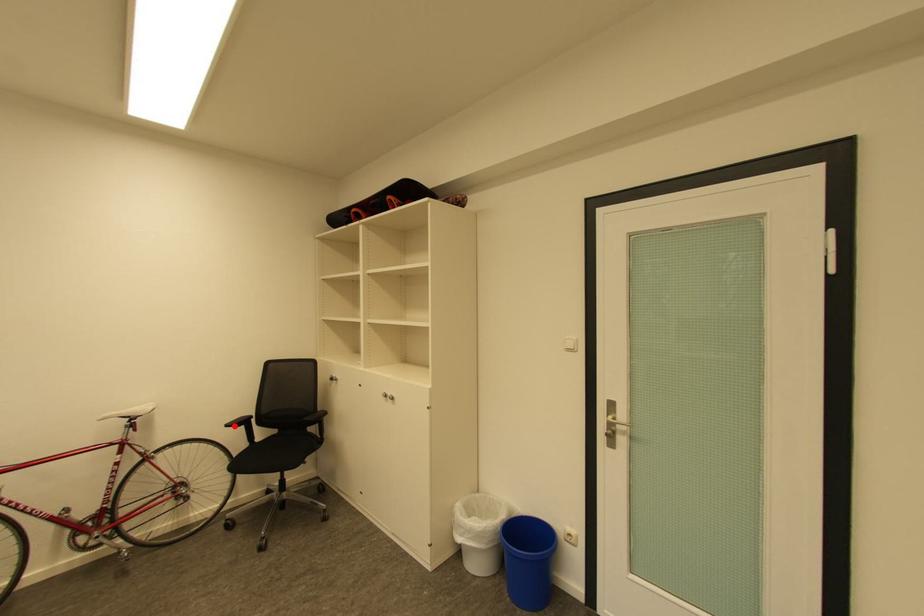
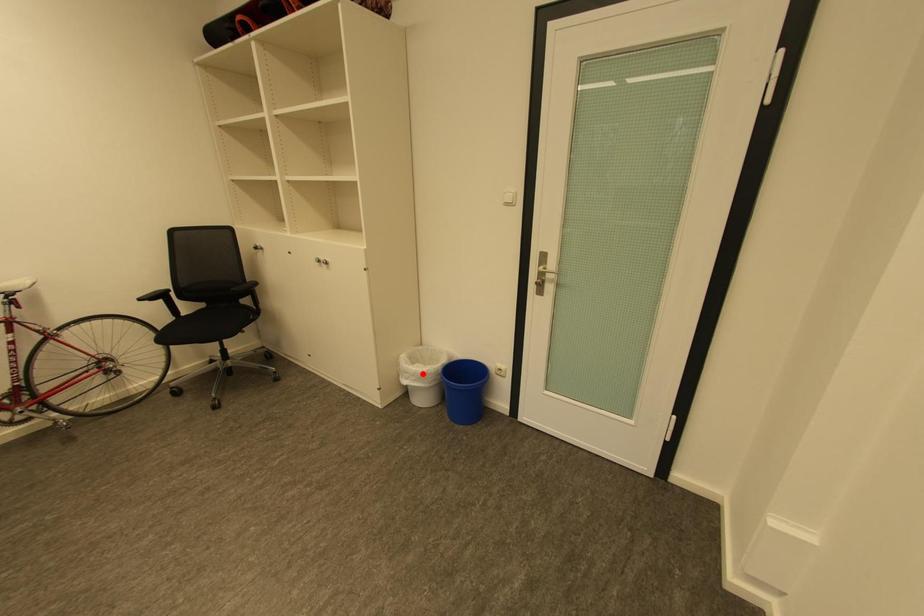
I am providing you with two images of the same scene from different viewpoints. A red point is marked on the first image and another point is marked on the second image. Do the highlighted points in image1 and image2 indicate the same real-world spot?

No